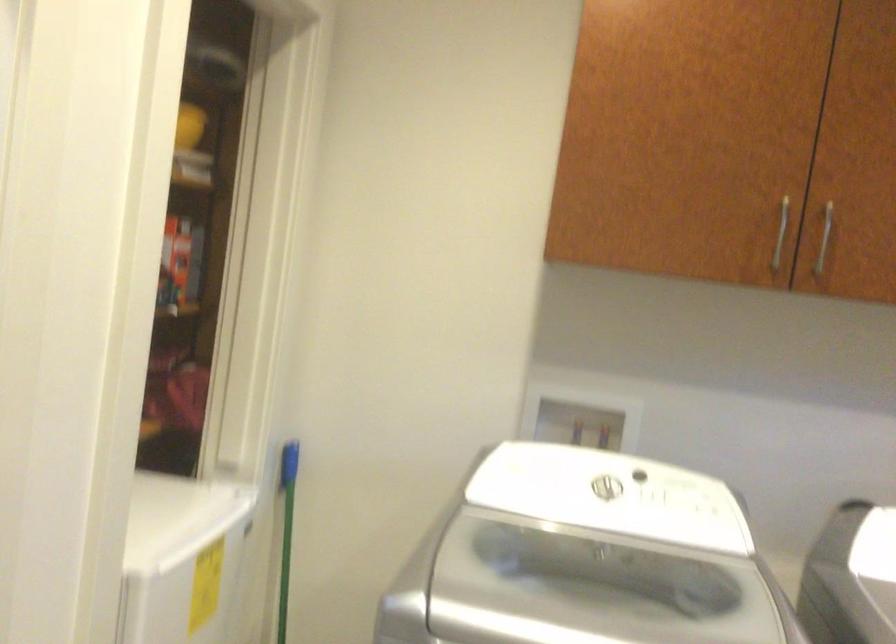
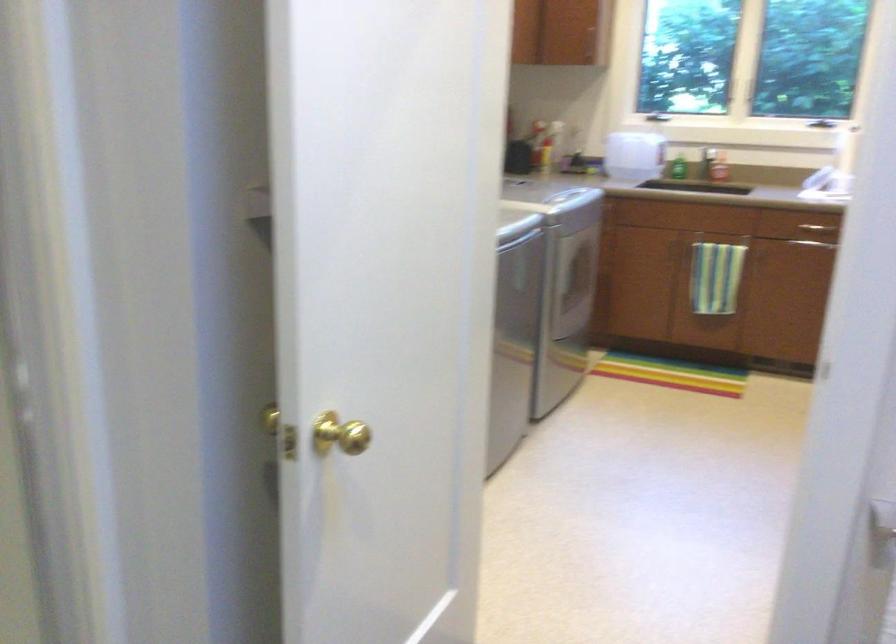
Question: I am providing you with two images of the same scene from different viewpoints. Please identify which objects are invisible in image2.

Choices:
 (A) washing machine lid
 (B) gold door knob
 (C) brown pencil
 (D) large plastic jug

Answer: (A)